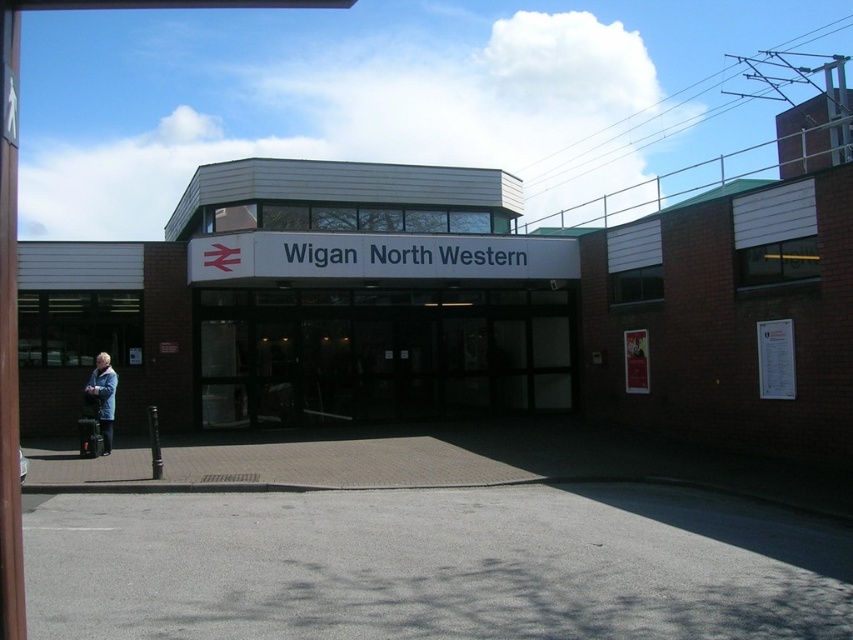
You are a delivery person carrying a large package and need to enter the station through the transparent glass doors at center. The blue denim jacket at left is blocking your path. Can you pass through the doors without moving the jacket?

The transparent glass doors at center are wider than the blue denim jacket at left, so you can pass through the doors without moving the jacket.

You are a delivery person with a cart that is 20 feet long. You need to move from the blue denim jacket at left to the transparent glass doors at center. Can your cart fit in the space between them?

The distance between the transparent glass doors at center and the blue denim jacket at left is 21.74 feet, so the cart that is 20 feet long can fit in the space between them since it is shorter than the available distance.